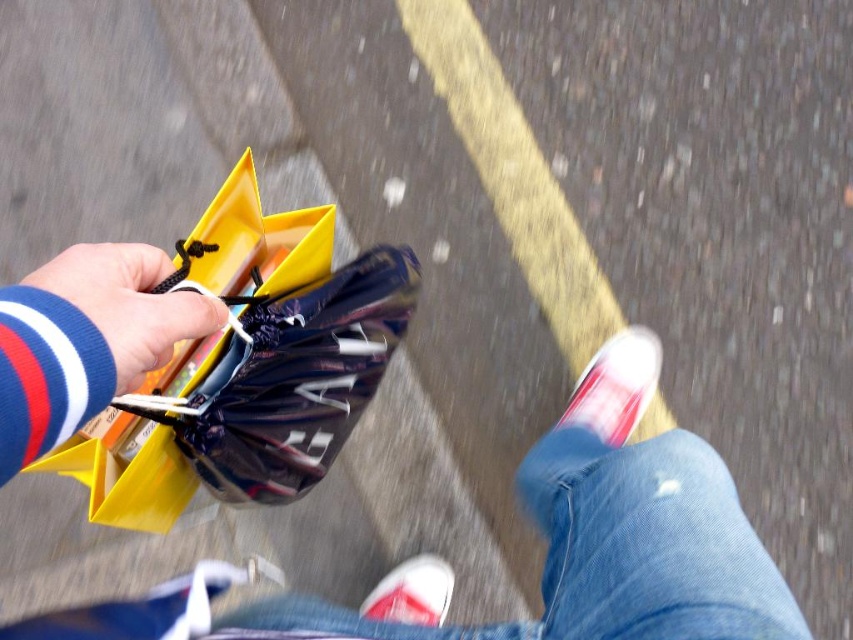
You are holding a matte yellow plastic bag at lower left. Where is it positioned relative to your current viewpoint?

The matte yellow plastic bag at lower left is located at point 0.594 on the x axis and 0.342 on the y axis.